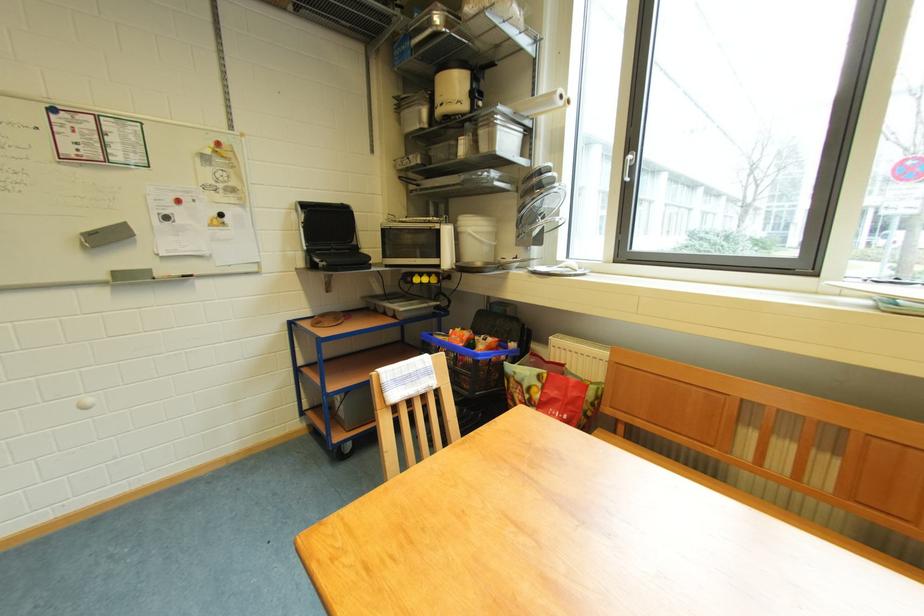
Where would you lift the metal pot lid? Please return your answer as a coordinate pair (x, y).

(454, 65)